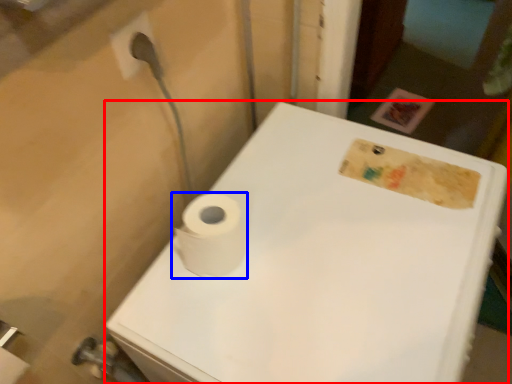
Question: Which object is closer to the camera taking this photo, porcelain (highlighted by a red box) or toilet paper (highlighted by a blue box)?

Choices:
 (A) porcelain
 (B) toilet paper

Answer: (A)